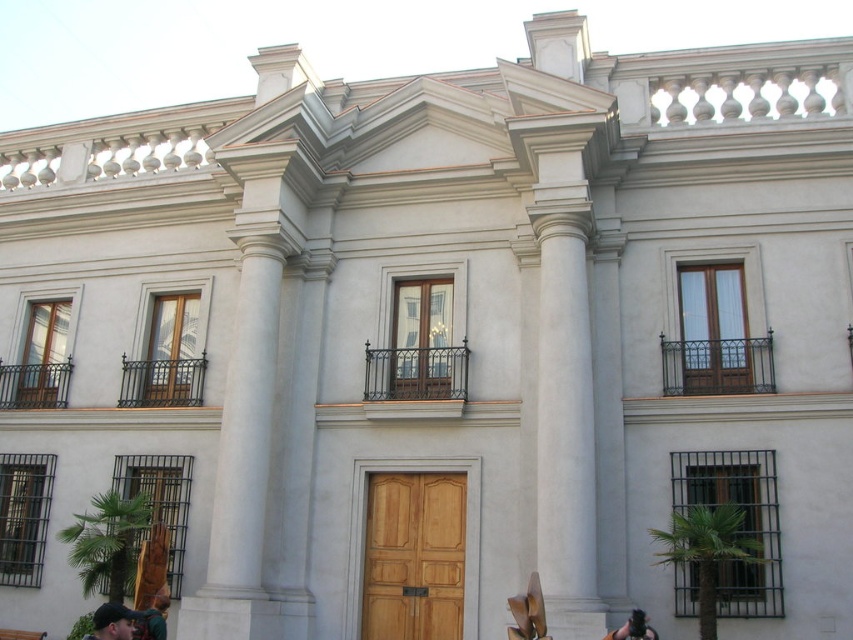
Question: Which point appears closest to the camera in this image?

Choices:
 (A) (141, 634)
 (B) (123, 618)

Answer: (B)

Question: Is dark blue fabric cap at lower left below dark brown leather jacket at lower right?

Choices:
 (A) yes
 (B) no

Answer: (A)

Question: Which is farther from the green fabric shirt at lower left?

Choices:
 (A) dark blue fabric cap at lower left
 (B) dark brown leather jacket at lower right

Answer: (B)

Question: Estimate the real-world distances between objects in this image. Which object is farther from the green fabric shirt at lower left?

Choices:
 (A) dark brown leather jacket at lower right
 (B) dark blue fabric cap at lower left

Answer: (A)

Question: From the image, what is the correct spatial relationship of green fabric shirt at lower left in relation to dark brown leather jacket at lower right?

Choices:
 (A) left
 (B) right

Answer: (A)

Question: Is green fabric shirt at lower left smaller than dark brown leather jacket at lower right?

Choices:
 (A) no
 (B) yes

Answer: (A)